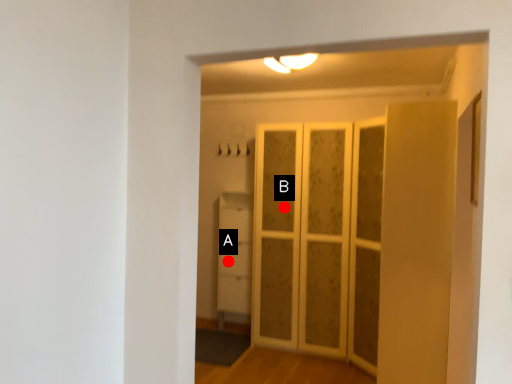
Question: Two points are circled on the image, labeled by A and B beside each circle. Which point is closer to the camera?

Choices:
 (A) A is closer
 (B) B is closer

Answer: (B)